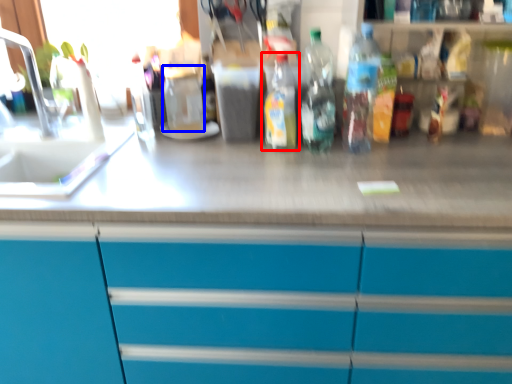
Question: Which object is further to the camera taking this photo, bottle (highlighted by a red box) or beverage (highlighted by a blue box)?

Choices:
 (A) bottle
 (B) beverage

Answer: (B)